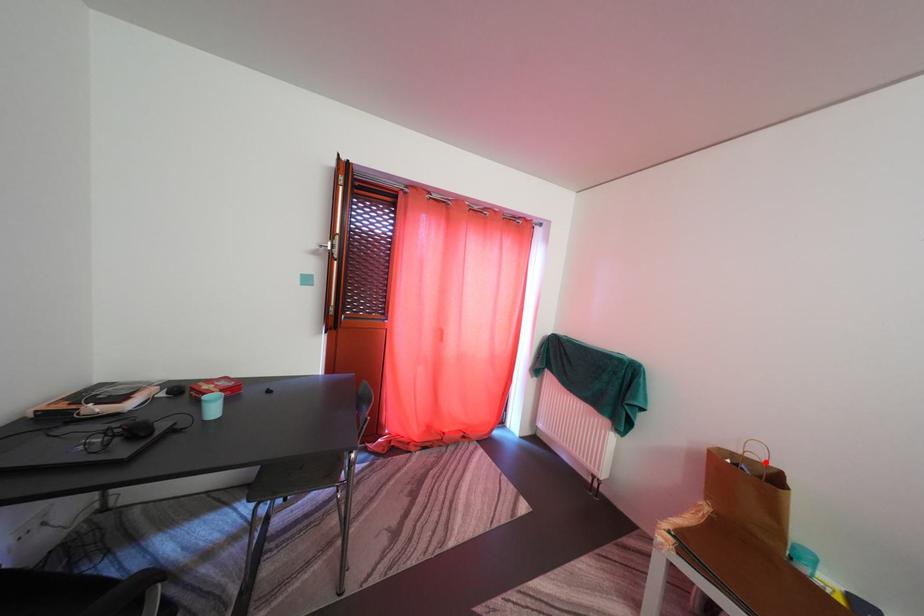
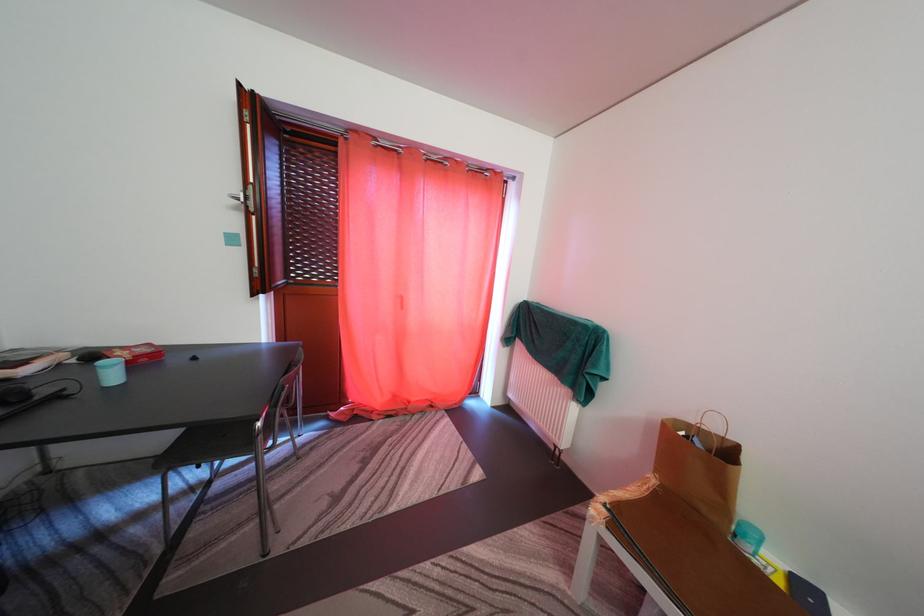
Question: I am providing you with two images of the same scene from different viewpoints. A red point is marked on the first image. Can you still see the location of the red point in image 2?

Choices:
 (A) Yes
 (B) No

Answer: (A)